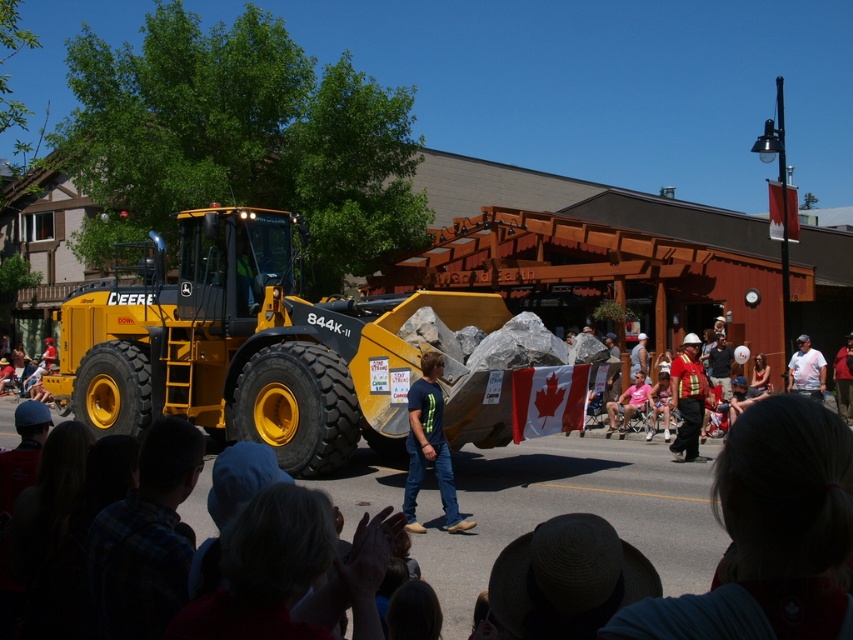
You are standing at the point labeled point (688,371) and want to walk to the point labeled point (384,348). Which direction should you move?

You should move forward because point (384,348) is in front of point (688,371).